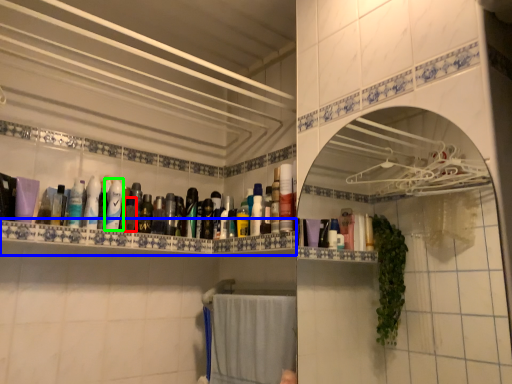
Question: Based on their relative distances, which object is farther from mouthwash (highlighted by a red box)? Choose from shelve (highlighted by a blue box) and mouthwash (highlighted by a green box).

Choices:
 (A) shelve
 (B) mouthwash

Answer: (A)